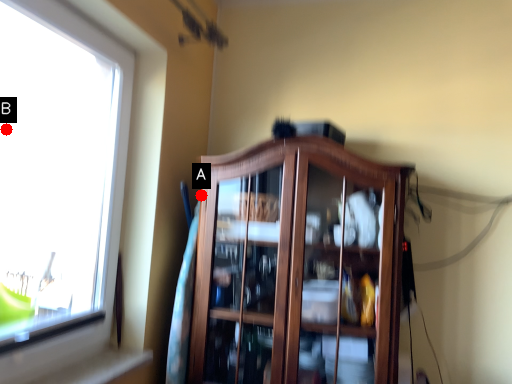
Question: Two points are circled on the image, labeled by A and B beside each circle. Which point is closer to the camera taking this photo?

Choices:
 (A) A is closer
 (B) B is closer

Answer: (A)